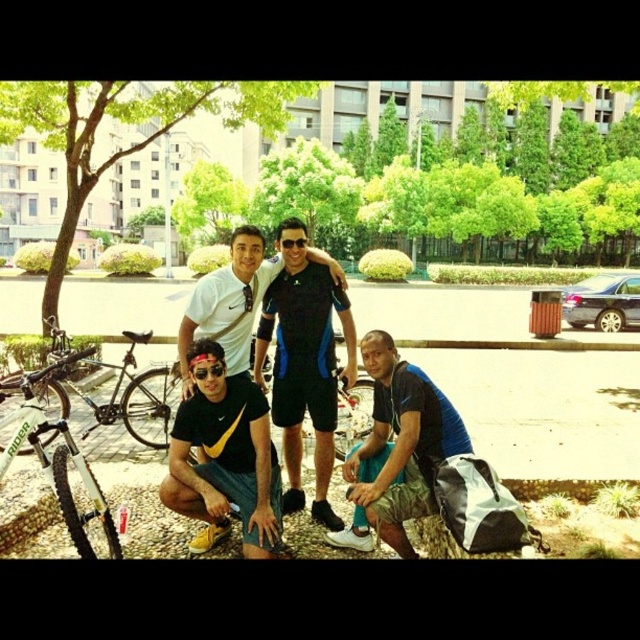
Question: Where is matte white shirt at center located in relation to silver metallic bicycle at lower left in the image?

Choices:
 (A) below
 (B) above

Answer: (B)

Question: Does black matte t-shirt at center have a smaller size compared to silver metallic bicycle at lower left?

Choices:
 (A) yes
 (B) no

Answer: (A)

Question: Which point appears closest to the camera in this image?

Choices:
 (A) (205, 275)
 (B) (212, 397)
 (C) (134, 419)
 (D) (426, 413)

Answer: (D)

Question: Which point appears farthest from the camera in this image?

Choices:
 (A) (195, 538)
 (B) (312, 273)

Answer: (B)

Question: Is blue fabric shorts at lower center wider than silver metallic bicycle at lower left?

Choices:
 (A) yes
 (B) no

Answer: (A)

Question: Which object appears farthest from the camera in this image?

Choices:
 (A) black matte t-shirt at center
 (B) silver metallic bicycle at lower left
 (C) blue athletic shorts at center

Answer: (C)